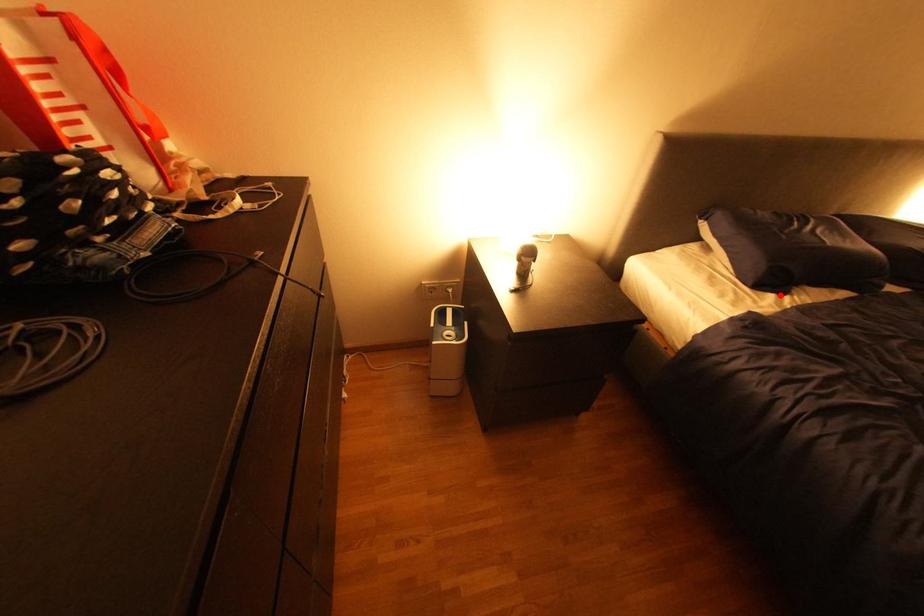
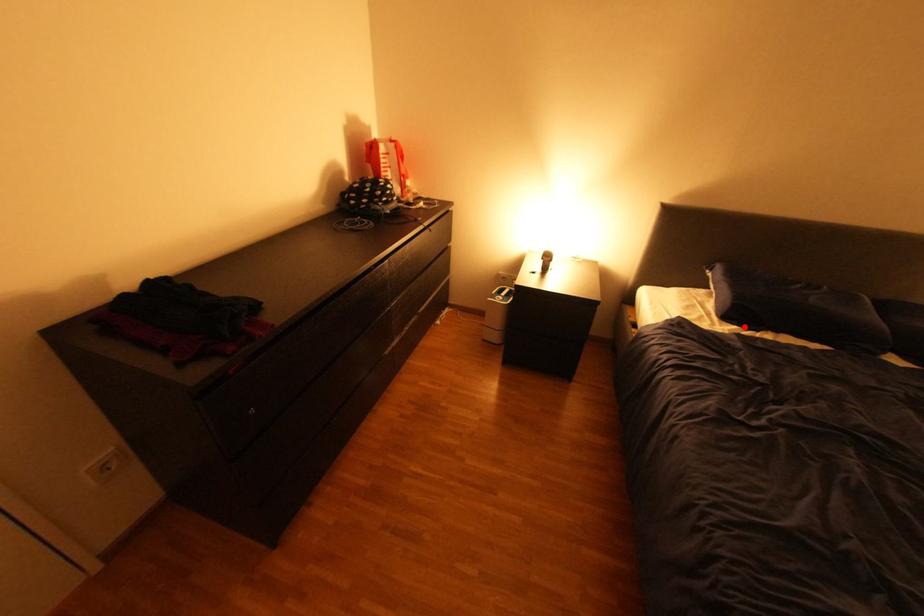
I am providing you with two images of the same scene from different viewpoints. A red point is marked on the first image and another point is marked on the second image. Do the highlighted points in image1 and image2 indicate the same real-world spot?

Yes